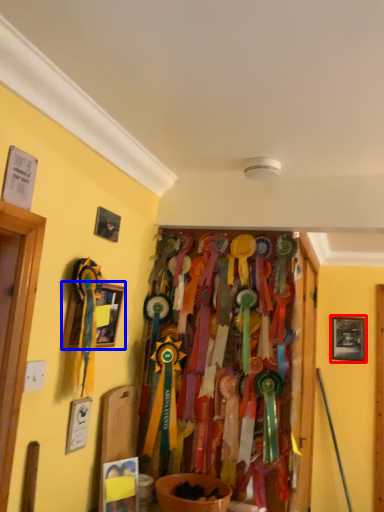
Question: Which object appears closest to the camera in this image, picture frame (highlighted by a red box) or picture frame (highlighted by a blue box)?

Choices:
 (A) picture frame
 (B) picture frame

Answer: (B)